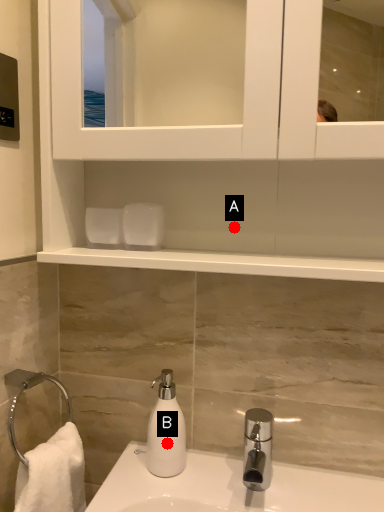
Question: Two points are circled on the image, labeled by A and B beside each circle. Which of the following is the farthest from the observer?

Choices:
 (A) A is further
 (B) B is further

Answer: (A)